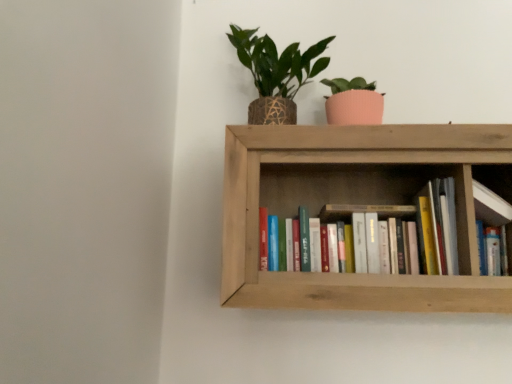
Question: Can you confirm if green woven pot at upper center is taller than wooden bookshelf at center?

Choices:
 (A) yes
 (B) no

Answer: (A)

Question: Considering the relative sizes of green woven pot at upper center and wooden bookshelf at center in the image provided, is green woven pot at upper center smaller than wooden bookshelf at center?

Choices:
 (A) yes
 (B) no

Answer: (A)

Question: From a real-world perspective, does green woven pot at upper center sit lower than wooden bookshelf at center?

Choices:
 (A) no
 (B) yes

Answer: (A)

Question: From the image's perspective, is green woven pot at upper center below wooden bookshelf at center?

Choices:
 (A) yes
 (B) no

Answer: (B)

Question: Is wooden bookshelf at center a part of green woven pot at upper center?

Choices:
 (A) yes
 (B) no

Answer: (B)

Question: Considering the relative positions of green woven pot at upper center and wooden bookshelf at center in the image provided, is green woven pot at upper center to the right of wooden bookshelf at center from the viewer's perspective?

Choices:
 (A) no
 (B) yes

Answer: (A)

Question: Can you confirm if wooden bookshelf at upper right is taller than hardcover books at center?

Choices:
 (A) no
 (B) yes

Answer: (B)

Question: Considering the relative sizes of wooden bookshelf at upper right and hardcover books at center in the image provided, is wooden bookshelf at upper right bigger than hardcover books at center?

Choices:
 (A) yes
 (B) no

Answer: (B)

Question: Is the surface of wooden bookshelf at upper right in direct contact with hardcover books at center?

Choices:
 (A) no
 (B) yes

Answer: (A)

Question: Can you confirm if wooden bookshelf at upper right is smaller than hardcover books at center?

Choices:
 (A) no
 (B) yes

Answer: (B)

Question: From a real-world perspective, is wooden bookshelf at upper right positioned over hardcover books at center based on gravity?

Choices:
 (A) yes
 (B) no

Answer: (A)

Question: Is wooden bookshelf at upper right not within hardcover books at center?

Choices:
 (A) yes
 (B) no

Answer: (A)

Question: From a real-world perspective, is green woven pot at upper center on top of hardcover books at center?

Choices:
 (A) no
 (B) yes

Answer: (B)